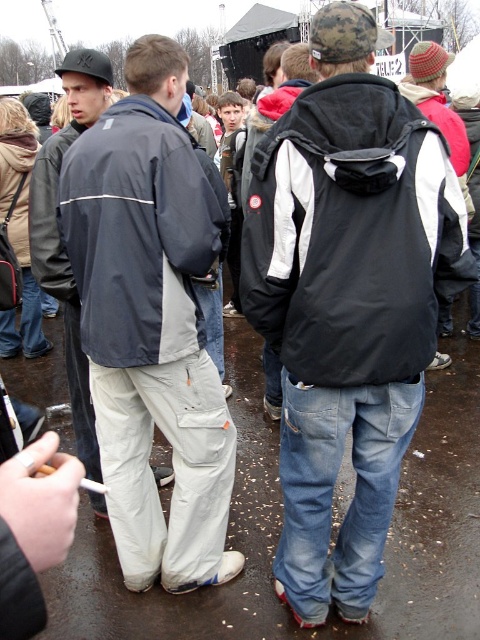
Can you confirm if black/white jacket at center is positioned to the right of matte black jacket at left?

Yes, black/white jacket at center is to the right of matte black jacket at left.

Does black/white jacket at center appear under matte black jacket at left?

Correct, black/white jacket at center is located below matte black jacket at left.

You are a GUI agent. You are given a task and a screenshot of the screen. Output one action in this format:
    pyautogui.click(x=<x>, y=<y>)
    Task: Click on the black/white jacket at center
    The width and height of the screenshot is (480, 640).
    Given the screenshot: What is the action you would take?
    pyautogui.click(x=351, y=237)

What do you see at coordinates (151, 324) in the screenshot?
I see `matte gray jacket at center` at bounding box center [151, 324].

Between matte gray jacket at center and black/white jacket at center, which one has less height?

Standing shorter between the two is black/white jacket at center.

Which is in front, point (207, 193) or point (407, 296)?

Positioned in front is point (407, 296).

At what (x,y) coordinates should I click in order to perform the action: click on matte gray jacket at center. Please return your answer as a coordinate pair (x, y). The width and height of the screenshot is (480, 640). Looking at the image, I should click on (151, 324).

From the picture: Which of these two, matte gray jacket at center or dark gray matte jacket at center, stands shorter?

dark gray matte jacket at center is shorter.

Who is more forward, [218,448] or [186,173]?

Positioned in front is point [186,173].

Measure the distance between point (176, 301) and camera.

Point (176, 301) is 7.25 feet from camera.

At what (x,y) coordinates should I click in order to perform the action: click on matte gray jacket at center. Please return your answer as a coordinate pair (x, y). The width and height of the screenshot is (480, 640). Looking at the image, I should click on (151, 324).